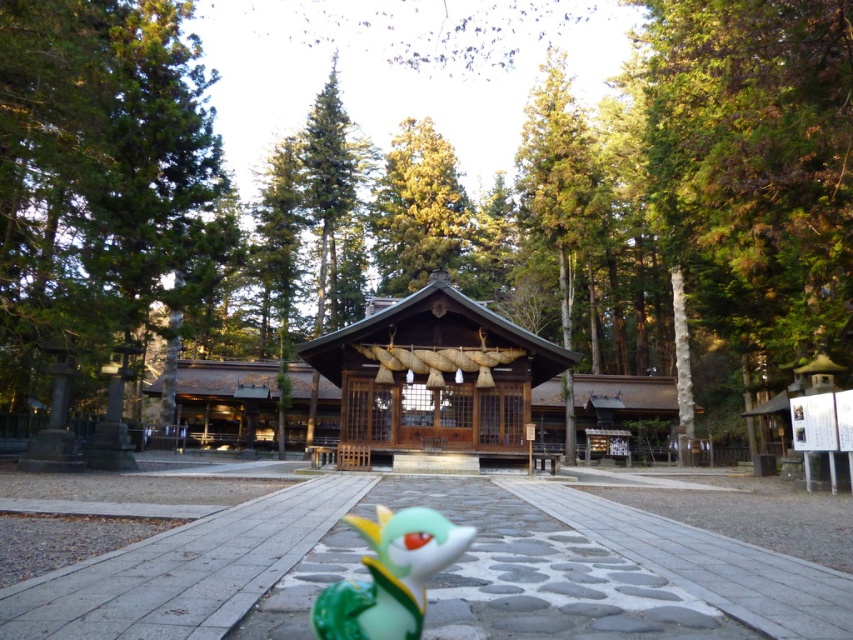
You are standing at the entrance of the temple and want to take a photo of the green textured tree at left without any obstructions. Given the temple pathway is paved and leads up to the structure, which direction should you walk to ensure the tree is fully visible in your frame?

To ensure the green textured tree at left is fully visible without obstructions, you should walk towards the paved pathway leading up to the temple. Since the tree is located at point coordinates, positioning yourself along the pathway will provide an unobstructed view.

You are a visitor at the temple and want to place a small offering on the green glossy toy at lower center. However, you notice a green textured tree at upper center nearby. Which object is taller, and does this affect your ability to place the offering?

The green textured tree at upper center is taller than the green glossy toy at lower center. However, since the toy is at lower center and the tree is at upper center, the height difference does not obstruct placing the offering on the green glossy toy at lower center.